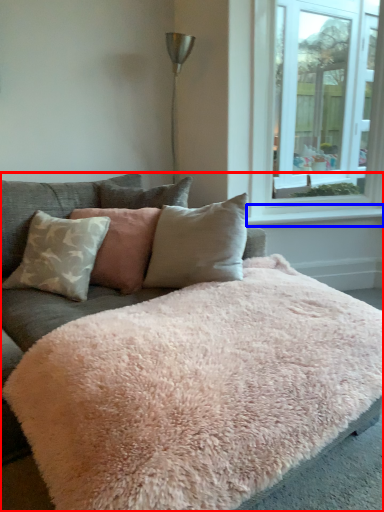
Question: Which object appears farthest to the camera in this image, studio couch (highlighted by a red box) or window sill (highlighted by a blue box)?

Choices:
 (A) studio couch
 (B) window sill

Answer: (B)